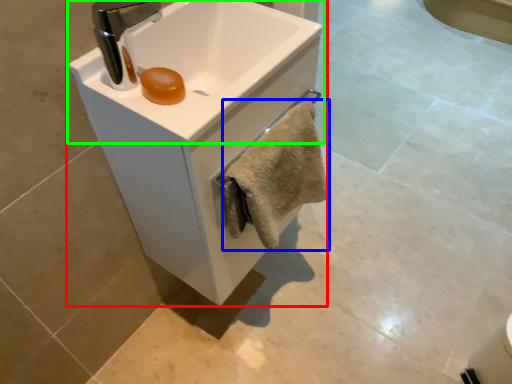
Question: Considering the real-world distances, which object is farthest from sink (highlighted by a red box)? bath towel (highlighted by a blue box) or sink (highlighted by a green box)?

Choices:
 (A) bath towel
 (B) sink

Answer: (A)